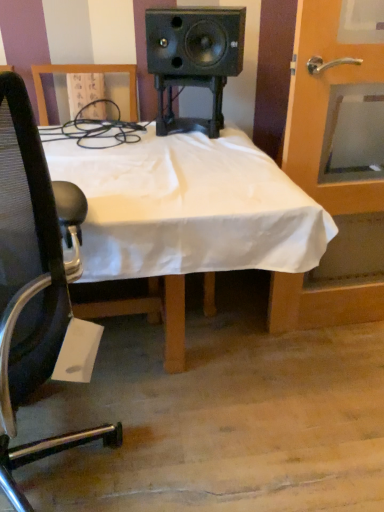
Question: Is white cloth-covered desk at center shorter than wooden door at right?

Choices:
 (A) yes
 (B) no

Answer: (A)

Question: Considering the relative sizes of white cloth-covered desk at center and wooden door at right in the image provided, is white cloth-covered desk at center wider than wooden door at right?

Choices:
 (A) no
 (B) yes

Answer: (B)

Question: From a real-world perspective, is white cloth-covered desk at center positioned under wooden door at right based on gravity?

Choices:
 (A) no
 (B) yes

Answer: (B)

Question: Can you confirm if white cloth-covered desk at center is thinner than wooden door at right?

Choices:
 (A) no
 (B) yes

Answer: (A)

Question: Would you say white cloth-covered desk at center is outside wooden door at right?

Choices:
 (A) no
 (B) yes

Answer: (B)

Question: Is white cloth-covered desk at center wider or thinner than wooden door at right?

Choices:
 (A) thin
 (B) wide

Answer: (B)

Question: Does point (64, 169) appear closer or farther from the camera than point (337, 74)?

Choices:
 (A) farther
 (B) closer

Answer: (B)

Question: Looking at the image, does white cloth-covered desk at center seem bigger or smaller compared to wooden door at right?

Choices:
 (A) big
 (B) small

Answer: (A)

Question: Is white cloth-covered desk at center spatially inside wooden door at right, or outside of it?

Choices:
 (A) inside
 (B) outside

Answer: (B)

Question: From the image's perspective, is wooden door at right above or below black mesh chair at left?

Choices:
 (A) above
 (B) below

Answer: (A)

Question: Considering the positions of wooden door at right and black mesh chair at left in the image, is wooden door at right bigger or smaller than black mesh chair at left?

Choices:
 (A) small
 (B) big

Answer: (A)

Question: Considering the positions of wooden door at right and black mesh chair at left in the image, is wooden door at right taller or shorter than black mesh chair at left?

Choices:
 (A) tall
 (B) short

Answer: (A)

Question: In terms of width, does wooden door at right look wider or thinner when compared to black mesh chair at left?

Choices:
 (A) wide
 (B) thin

Answer: (B)

Question: Is point (13, 272) closer or farther from the camera than point (332, 303)?

Choices:
 (A) closer
 (B) farther

Answer: (A)

Question: Based on their sizes in the image, would you say black mesh chair at left is bigger or smaller than wooden door at right?

Choices:
 (A) small
 (B) big

Answer: (B)